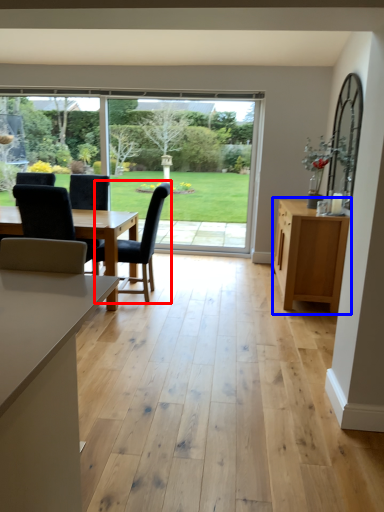
Question: Among these objects, which one is nearest to the camera, chair (highlighted by a red box) or cabinetry (highlighted by a blue box)?

Choices:
 (A) chair
 (B) cabinetry

Answer: (B)